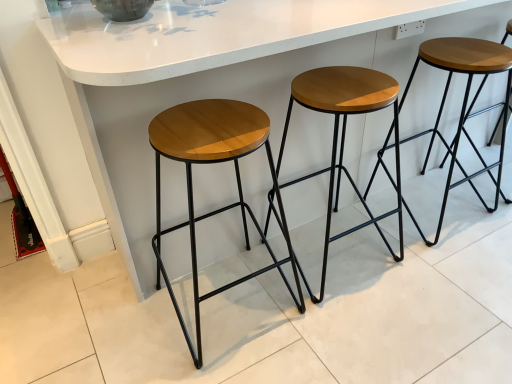
Find the location of `free point to the left of wooden/matte stool at center, placed as the first stool when sorted from left to right`. free point to the left of wooden/matte stool at center, placed as the first stool when sorted from left to right is located at coordinates (119, 324).